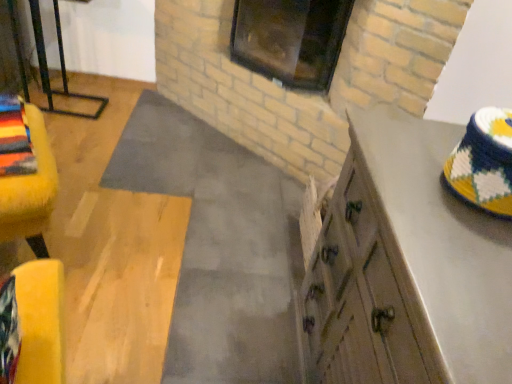
Question: Is dark glass window at upper center positioned in front of yellow fuzzy ottoman at left?

Choices:
 (A) no
 (B) yes

Answer: (A)

Question: From a real-world perspective, is dark glass window at upper center on top of yellow fuzzy ottoman at left?

Choices:
 (A) yes
 (B) no

Answer: (A)

Question: Is dark glass window at upper center next to yellow fuzzy ottoman at left?

Choices:
 (A) no
 (B) yes

Answer: (A)

Question: Is the position of dark glass window at upper center more distant than that of yellow fuzzy ottoman at left?

Choices:
 (A) yes
 (B) no

Answer: (A)

Question: Is dark glass window at upper center wider than yellow fuzzy ottoman at left?

Choices:
 (A) yes
 (B) no

Answer: (A)

Question: Considering the positions of point (26, 153) and point (431, 124), is point (26, 153) closer or farther from the camera than point (431, 124)?

Choices:
 (A) closer
 (B) farther

Answer: (B)

Question: Is yellow fuzzy ottoman at left inside the boundaries of wooden cabinet at right, or outside?

Choices:
 (A) inside
 (B) outside

Answer: (B)

Question: Based on their sizes in the image, would you say yellow fuzzy ottoman at left is bigger or smaller than wooden cabinet at right?

Choices:
 (A) small
 (B) big

Answer: (A)

Question: Is yellow fuzzy ottoman at left taller or shorter than wooden cabinet at right?

Choices:
 (A) short
 (B) tall

Answer: (A)

Question: Considering the positions of dark glass window at upper center and yellow fuzzy ottoman at left in the image, is dark glass window at upper center taller or shorter than yellow fuzzy ottoman at left?

Choices:
 (A) short
 (B) tall

Answer: (B)

Question: Based on their positions, is dark glass window at upper center located to the left or right of yellow fuzzy ottoman at left?

Choices:
 (A) left
 (B) right

Answer: (B)

Question: Is dark glass window at upper center spatially inside yellow fuzzy ottoman at left, or outside of it?

Choices:
 (A) inside
 (B) outside

Answer: (B)

Question: From a real-world perspective, is dark glass window at upper center physically located above or below yellow fuzzy ottoman at left?

Choices:
 (A) above
 (B) below

Answer: (A)

Question: Does point (1, 201) appear closer or farther from the camera than point (334, 8)?

Choices:
 (A) closer
 (B) farther

Answer: (A)

Question: Is yellow fuzzy ottoman at left situated inside dark glass window at upper center or outside?

Choices:
 (A) outside
 (B) inside

Answer: (A)